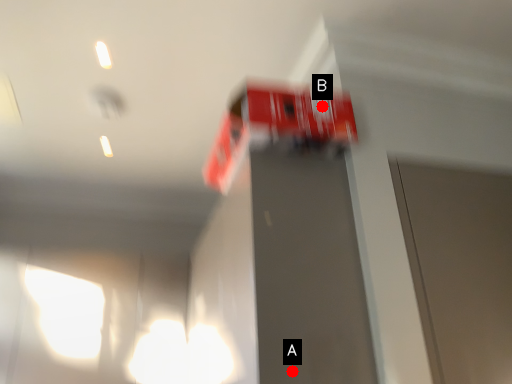
Question: Two points are circled on the image, labeled by A and B beside each circle. Which point is farther to the camera?

Choices:
 (A) A is further
 (B) B is further

Answer: (B)